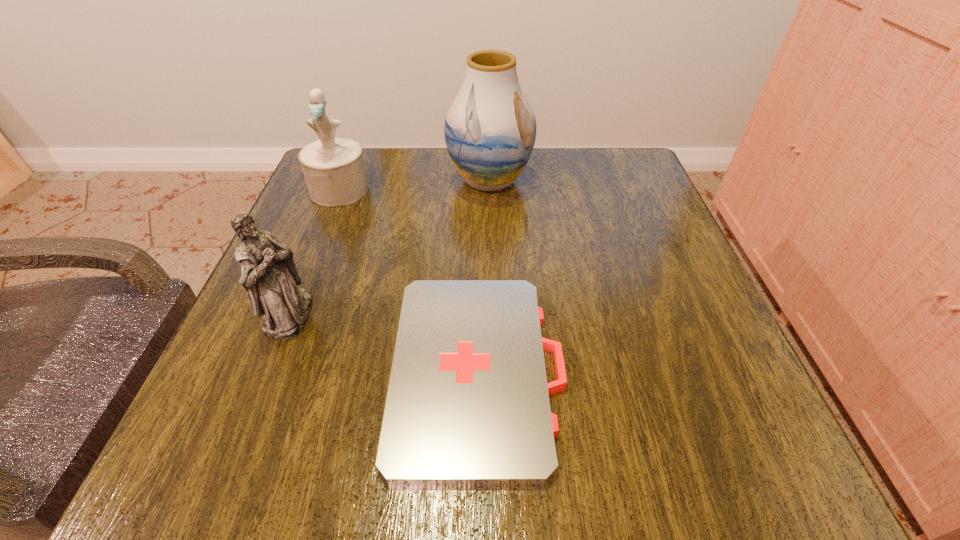
Find the location of a particular element. This screenshot has height=540, width=960. vase is located at coordinates (490, 129).

At what (x,y) coordinates should I click in order to perform the action: click on the farther figurine. Please return your answer as a coordinate pair (x, y). The image size is (960, 540). Looking at the image, I should click on (334, 169).

Find the location of a particular element. This screenshot has height=540, width=960. the nearer figurine is located at coordinates (269, 275).

The image size is (960, 540). In order to click on the shortest object in this screenshot , I will do `click(468, 403)`.

I want to click on vacant region located on the right of the vase, so click(635, 181).

The height and width of the screenshot is (540, 960). I want to click on blank space located 0.380m at the beak of the farther figurine, so click(x=276, y=351).

At what (x,y) coordinates should I click in order to perform the action: click on vacant area situated 0.060m on the front-facing side of the nearer figurine. Please return your answer as a coordinate pair (x, y). This screenshot has width=960, height=540. Looking at the image, I should click on pyautogui.click(x=347, y=315).

At what (x,y) coordinates should I click in order to perform the action: click on free space located 0.230m on handle side the first-aid kit. Please return your answer as a coordinate pair (x, y). Image resolution: width=960 pixels, height=540 pixels. Looking at the image, I should click on (714, 369).

Locate an element on the screen. The image size is (960, 540). vase that is at the far edge is located at coordinates (490, 129).

Locate an element on the screen. The height and width of the screenshot is (540, 960). figurine that is positioned at the far edge is located at coordinates (334, 169).